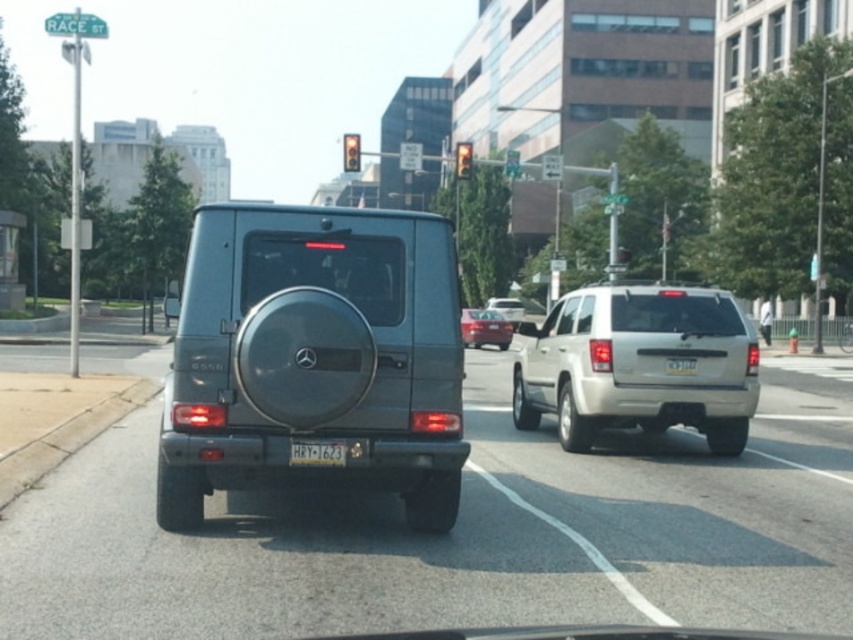
Is silver metallic suv at center bigger than white plastic license plate at center?

Indeed, silver metallic suv at center has a larger size compared to white plastic license plate at center.

Is point (643, 339) farther from camera compared to point (341, 464)?

Yes, point (643, 339) is behind point (341, 464).

You are a GUI agent. You are given a task and a screenshot of the screen. Output one action in this format:
    pyautogui.click(x=<x>, y=<y>)
    Task: Click on the silver metallic suv at center
    Image resolution: width=853 pixels, height=640 pixels.
    Given the screenshot: What is the action you would take?
    pyautogui.click(x=637, y=364)

Is red glass traffic light at center wider than yellow matte license plate at center?

Correct, the width of red glass traffic light at center exceeds that of yellow matte license plate at center.

Who is lower down, red glass traffic light at center or yellow matte license plate at center?

yellow matte license plate at center is lower down.

Is point (358, 152) behind point (671, 362)?

Yes, it is behind point (671, 362).

Locate an element on the screen. This screenshot has width=853, height=640. red glass traffic light at center is located at coordinates (351, 152).

Can you confirm if matte gray suv at center is positioned above matte silver suv at center?

Incorrect, matte gray suv at center is not positioned above matte silver suv at center.

Which is in front, point (227, 250) or point (511, 308)?

Point (227, 250) is more forward.

You are a GUI agent. You are given a task and a screenshot of the screen. Output one action in this format:
    pyautogui.click(x=<x>, y=<y>)
    Task: Click on the matte gray suv at center
    The width and height of the screenshot is (853, 640).
    Given the screenshot: What is the action you would take?
    pyautogui.click(x=315, y=358)